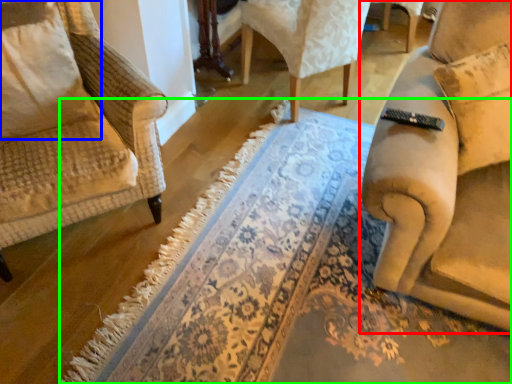
Question: Estimate the real-world distances between objects in this image. Which object is farther from chair (highlighted by a red box), pillow (highlighted by a blue box) or doormat (highlighted by a green box)?

Choices:
 (A) pillow
 (B) doormat

Answer: (A)